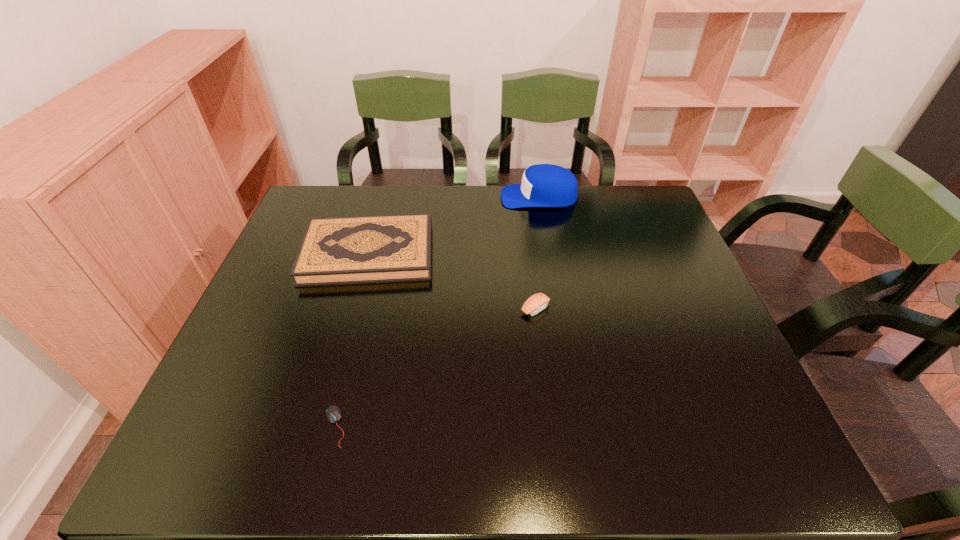
Identify the location of vacant region between the hardback book and the second nearest object. The height and width of the screenshot is (540, 960). (452, 280).

The image size is (960, 540). I want to click on free point between the nearest object and the second nearest object, so click(x=435, y=367).

Where is `unoccupied position between the shortest object and the hardback book`? This screenshot has height=540, width=960. unoccupied position between the shortest object and the hardback book is located at coordinates (351, 340).

Locate an element on the screen. The height and width of the screenshot is (540, 960). free space between the baseball cap and the second tallest object is located at coordinates (454, 225).

Select which object is the third closest to the third tallest object. Please provide its 2D coordinates. Your answer should be formatted as a tuple, i.e. [(x, y)], where the tuple contains the x and y coordinates of a point satisfying the conditions above.

[(333, 413)]

Identify the location of object identified as the closest to the baseball cap. The width and height of the screenshot is (960, 540). (365, 249).

The image size is (960, 540). Identify the location of vacant space that satisfies the following two spatial constraints: 1. on the front-facing side of the farthest object; 2. on the front side of the shortest object. (x=578, y=427).

At what (x,y) coordinates should I click in order to perform the action: click on free location that satisfies the following two spatial constraints: 1. on the front-facing side of the farthest object; 2. on the front side of the mouse. Please return your answer as a coordinate pair (x, y). The image size is (960, 540). Looking at the image, I should click on pyautogui.click(x=578, y=427).

This screenshot has width=960, height=540. I want to click on vacant space that satisfies the following two spatial constraints: 1. on the front side of the shortest object; 2. on the right side of the hardback book, so click(321, 427).

Where is `free space that satisfies the following two spatial constraints: 1. on the back side of the mouse; 2. on the right side of the second shortest object`? The image size is (960, 540). free space that satisfies the following two spatial constraints: 1. on the back side of the mouse; 2. on the right side of the second shortest object is located at coordinates (365, 308).